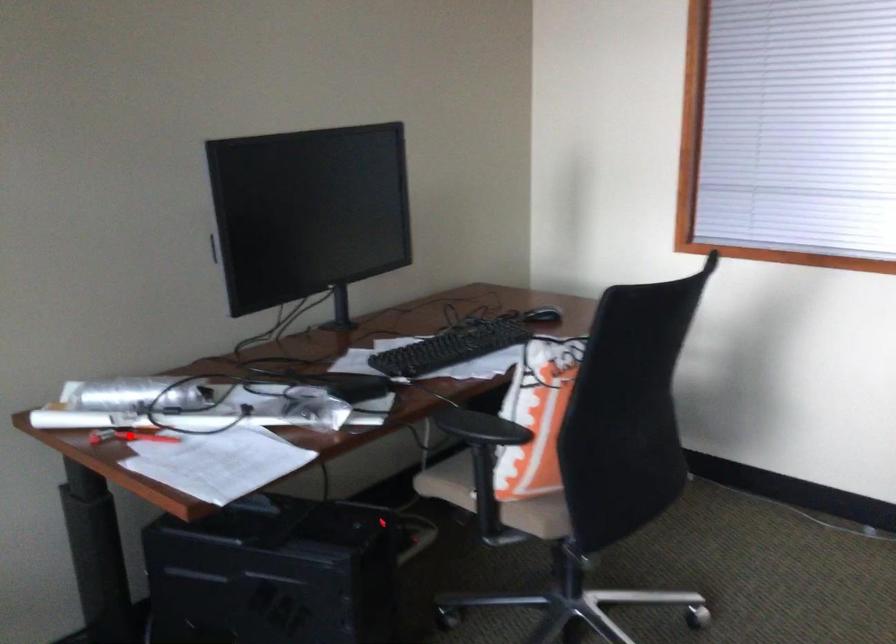
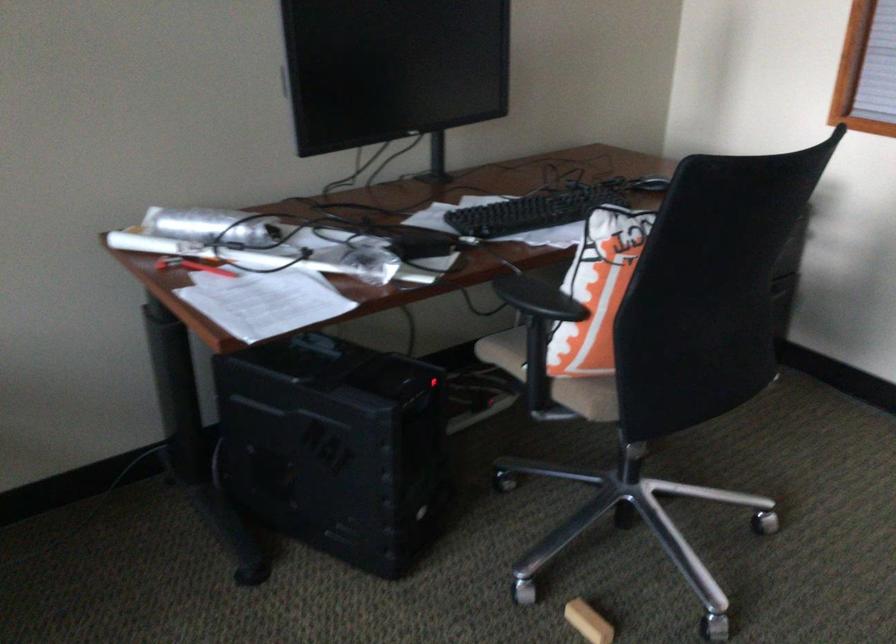
In the second image, find the point that corresponds to the highlighted location in the first image.

(192, 266)